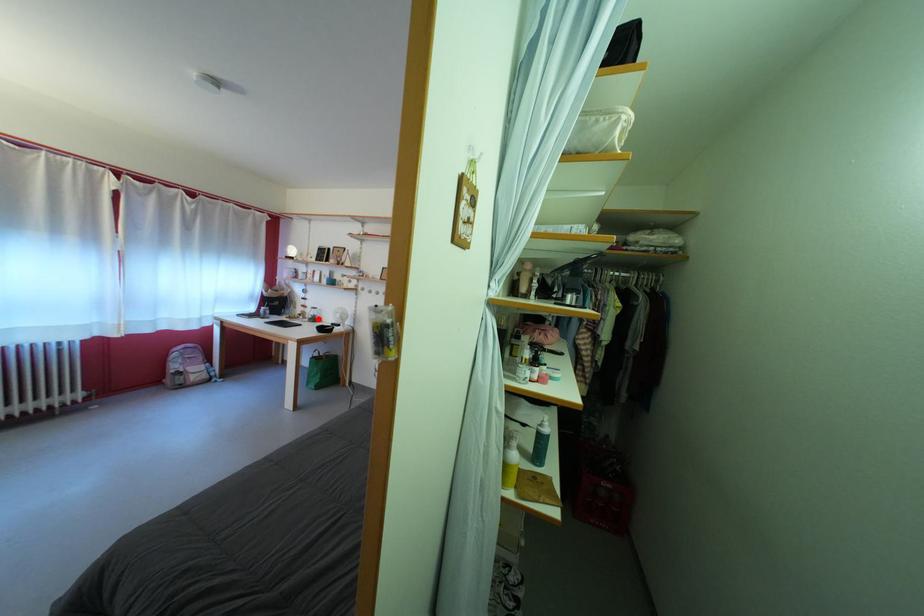
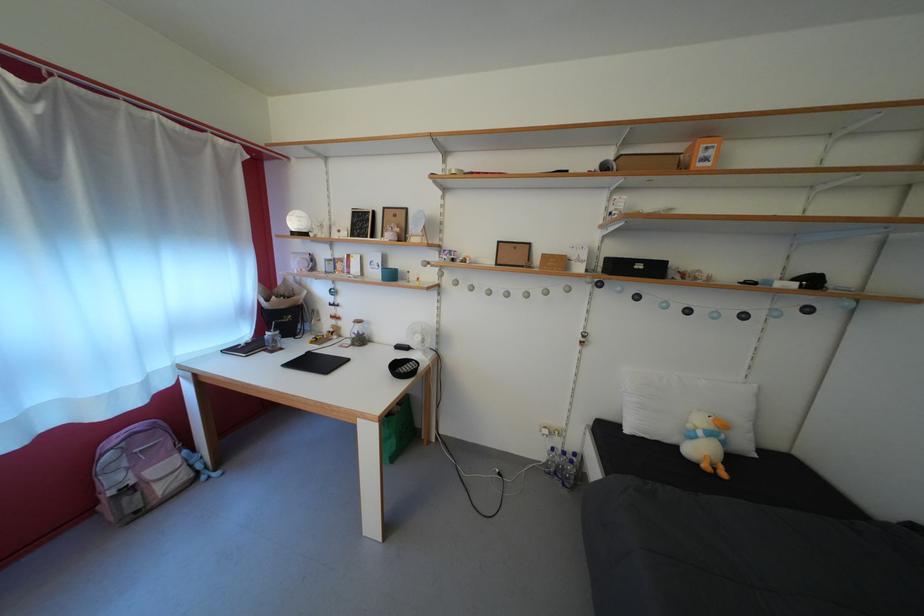
Locate, in the second image, the point that corresponds to the highlighted location in the first image.

(358, 334)